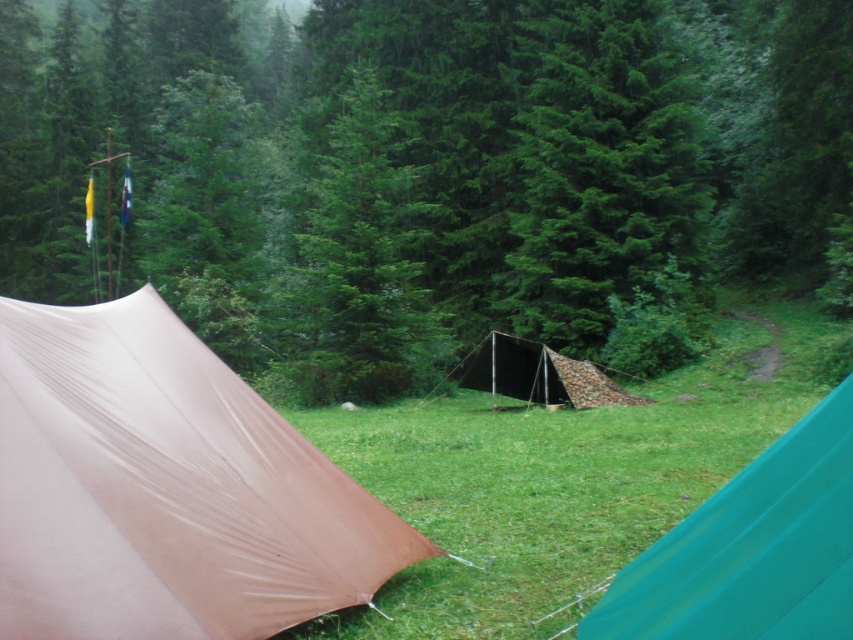
Question: Does green matte tree at center have a lesser width compared to camouflage fabric tent at center?

Choices:
 (A) no
 (B) yes

Answer: (A)

Question: Based on their relative distances, which object is nearer to the camouflage fabric tent at center?

Choices:
 (A) green matte tree at upper center
 (B) green matte tree at center

Answer: (B)

Question: Which point is farther from the camera taking this photo?

Choices:
 (A) (x=595, y=385)
 (B) (x=273, y=442)
 (C) (x=328, y=234)

Answer: (C)

Question: Which of the following is the farthest from the observer?

Choices:
 (A) tan fabric tent at left
 (B) camo fabric tent at center
 (C) green matte tree at upper center
 (D) green matte tree at center

Answer: (D)

Question: Is green matte tree at center closer to the viewer compared to camouflage fabric tent at center?

Choices:
 (A) yes
 (B) no

Answer: (B)

Question: Is green grass at center further to camera compared to green matte tree at center?

Choices:
 (A) no
 (B) yes

Answer: (A)